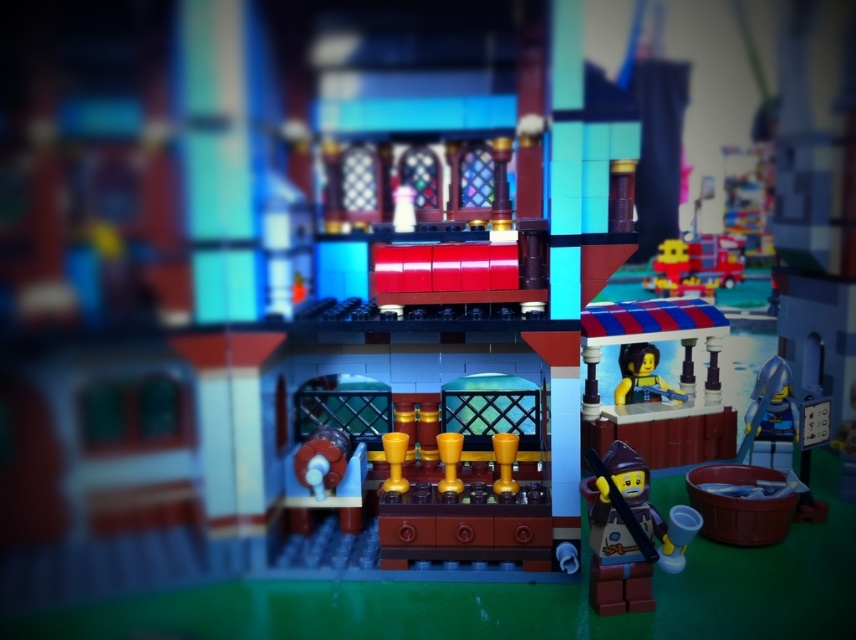
Question: Which of the following is the closest to the observer?

Choices:
 (A) (605, 524)
 (B) (724, 416)

Answer: (A)

Question: Estimate the real-world distances between objects in this image. Which object is closer to the brown matte minifigure at lower right?

Choices:
 (A) smooth plastic figure at center
 (B) striped fabric stand at right

Answer: (B)

Question: Is brown matte minifigure at lower right smaller than smooth plastic figure at center?

Choices:
 (A) yes
 (B) no

Answer: (B)

Question: Which point is closer to the camera taking this photo?

Choices:
 (A) (660, 390)
 (B) (654, 408)
 (C) (597, 524)

Answer: (C)

Question: Is brown matte minifigure at lower right to the left of smooth plastic figure at center from the viewer's perspective?

Choices:
 (A) yes
 (B) no

Answer: (A)

Question: From the image, what is the correct spatial relationship of brown matte minifigure at lower right in relation to smooth plastic figure at center?

Choices:
 (A) below
 (B) above

Answer: (A)